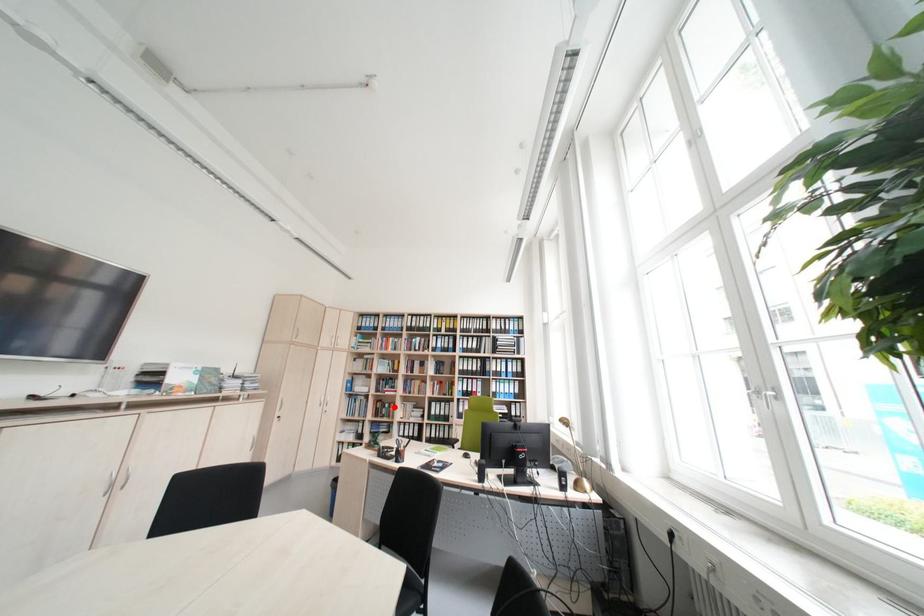
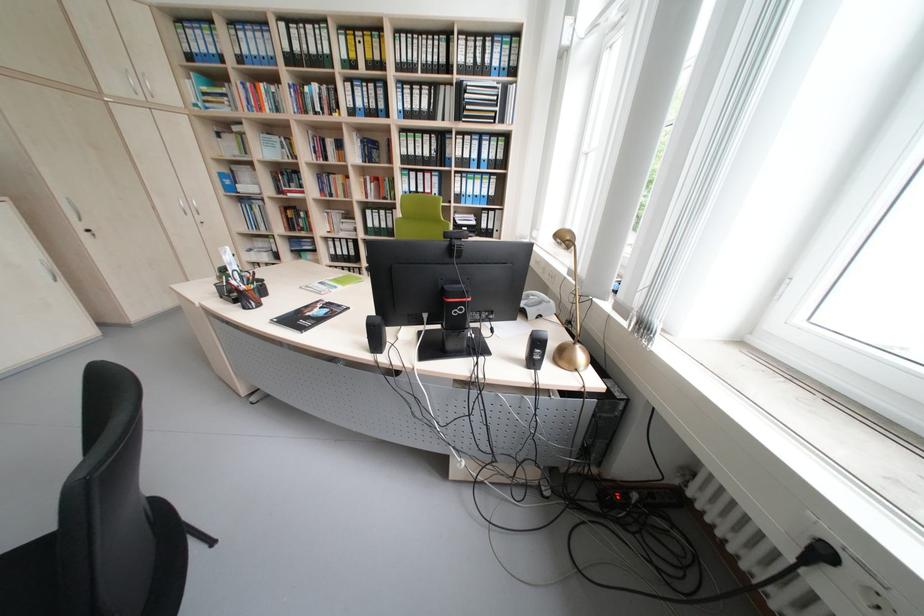
Find the pixel in the second image that matches the highlighted location in the first image.

(309, 217)